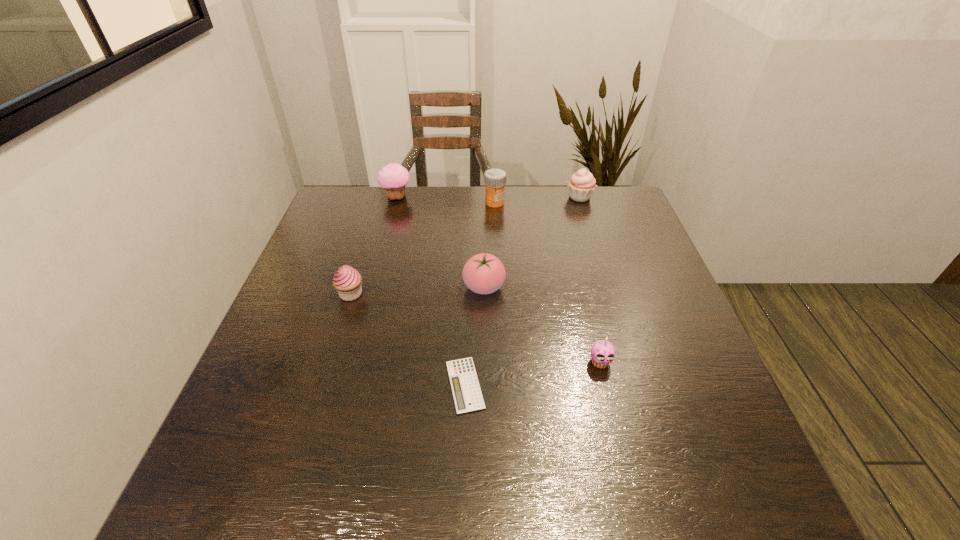
Identify the location of medicine. This screenshot has height=540, width=960. (495, 179).

I want to click on tomato, so click(x=484, y=273).

Where is `the second nearest cupcake`? The image size is (960, 540). the second nearest cupcake is located at coordinates (347, 281).

Where is `the sixth tallest object`? the sixth tallest object is located at coordinates (602, 352).

Find the location of a particular element. the nearest cupcake is located at coordinates (602, 352).

The image size is (960, 540). I want to click on the shortest object, so click(466, 391).

Image resolution: width=960 pixels, height=540 pixels. Identify the location of free region located on the label side of the medicine. [497, 264].

Where is `vacant space located on the front of the tomato`? Image resolution: width=960 pixels, height=540 pixels. vacant space located on the front of the tomato is located at coordinates (485, 399).

Locate an element on the screen. The image size is (960, 540). free point located on the back of the third farthest cupcake is located at coordinates (362, 259).

You are a GUI agent. You are given a task and a screenshot of the screen. Output one action in this format:
    pyautogui.click(x=<x>, y=<y>)
    Task: Click on the free region located on the face of the nearest cupcake
    
    Given the screenshot: What is the action you would take?
    pyautogui.click(x=613, y=415)